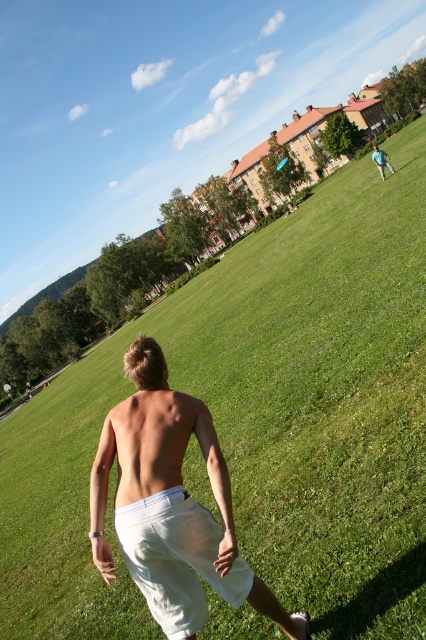
Question: Does white cotton shorts at center appear on the right side of green fabric shirt at upper right?

Choices:
 (A) no
 (B) yes

Answer: (A)

Question: Which point is closer to the camera?

Choices:
 (A) white cotton shorts at lower center
 (B) skinny white shorts at center
 (C) white cotton shorts at center

Answer: (C)

Question: Considering the relative positions of white cotton shorts at center and white cotton shorts at lower center in the image provided, where is white cotton shorts at center located with respect to white cotton shorts at lower center?

Choices:
 (A) left
 (B) right

Answer: (A)

Question: Which of the following is the farthest from the observer?

Choices:
 (A) (180, 413)
 (B) (143, 500)

Answer: (A)

Question: Which object is farther from the camera taking this photo?

Choices:
 (A) skinny white shorts at center
 (B) white cotton shorts at lower center

Answer: (A)

Question: Is skinny white shorts at center bigger than green fabric shirt at upper right?

Choices:
 (A) no
 (B) yes

Answer: (A)